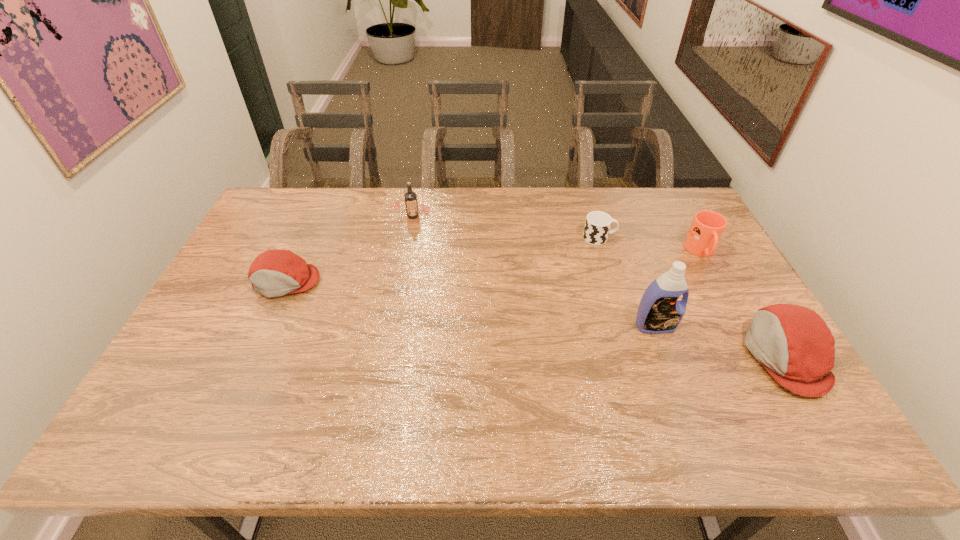
In order to click on the left cap in this screenshot , I will do `click(276, 272)`.

At what (x,y) coordinates should I click in order to perform the action: click on the shorter cap. Please return your answer as a coordinate pair (x, y). Looking at the image, I should click on (276, 272).

Where is `the nearer cap`? the nearer cap is located at coordinates (796, 346).

This screenshot has width=960, height=540. In order to click on the right cap in this screenshot , I will do point(796,346).

Find the location of `mug`. mug is located at coordinates (707, 227).

Where is `the fifth object from right to left`? This screenshot has width=960, height=540. the fifth object from right to left is located at coordinates (410, 197).

Locate an element on the screen. The width and height of the screenshot is (960, 540). the farthest object is located at coordinates (410, 197).

Locate an element on the screen. cup is located at coordinates (597, 226).

You are a GUI agent. You are given a task and a screenshot of the screen. Output one action in this format:
    pyautogui.click(x=<x>, y=<y>)
    Task: Click on the detergent
    The image size is (960, 540).
    Given the screenshot: What is the action you would take?
    pyautogui.click(x=660, y=311)

At what (x,y) coordinates should I click in order to perform the action: click on vacant area located on the front-facing side of the shorter cap. Please return your answer as a coordinate pair (x, y). Looking at the image, I should click on (262, 336).